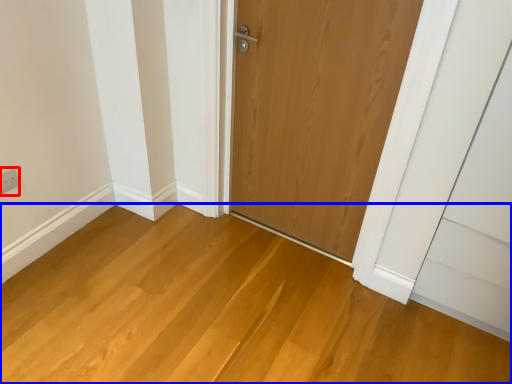
Question: Which object is closer to the camera taking this photo, electric outlet (highlighted by a red box) or plain (highlighted by a blue box)?

Choices:
 (A) electric outlet
 (B) plain

Answer: (B)